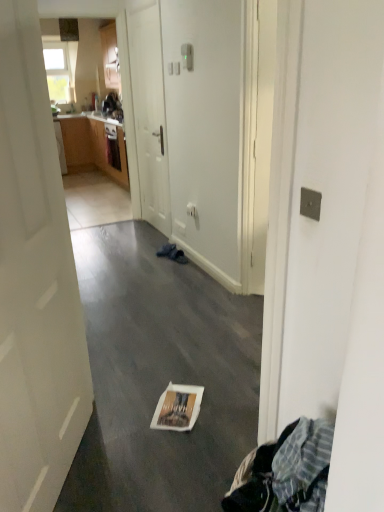
Question: From the image's perspective, does white paper bag at center appear lower than white glossy door at left, arranged as the 1th door when viewed from the front?

Choices:
 (A) yes
 (B) no

Answer: (A)

Question: Does white paper bag at center turn towards white glossy door at left, the 2th door viewed from the back?

Choices:
 (A) no
 (B) yes

Answer: (A)

Question: Is white glossy door at left, arranged as the 1th door when viewed from the front, surrounded by white paper bag at center?

Choices:
 (A) no
 (B) yes

Answer: (A)

Question: From a real-world perspective, is white paper bag at center positioned over white glossy door at left, the 2th door viewed from the back, based on gravity?

Choices:
 (A) no
 (B) yes

Answer: (A)

Question: Is white paper bag at center completely or partially outside of white glossy door at left, the 2th door viewed from the back?

Choices:
 (A) no
 (B) yes

Answer: (B)

Question: Based on their positions, is white glossy magazine at center located to the left or right of white paper bag at center?

Choices:
 (A) right
 (B) left

Answer: (A)

Question: From a real-world perspective, is white glossy magazine at center above or below white paper bag at center?

Choices:
 (A) above
 (B) below

Answer: (B)

Question: Considering the positions of point (188, 396) and point (140, 301), is point (188, 396) closer or farther from the camera than point (140, 301)?

Choices:
 (A) farther
 (B) closer

Answer: (B)

Question: Relative to white paper bag at center, is white glossy magazine at center in front or behind?

Choices:
 (A) behind
 (B) front

Answer: (A)

Question: Relative to white paper bag at center, is white glossy door at left, the 2th door viewed from the back, in front or behind?

Choices:
 (A) front
 (B) behind

Answer: (A)

Question: Choose the correct answer: Is white glossy door at left, the 2th door viewed from the back, inside white paper bag at center or outside it?

Choices:
 (A) outside
 (B) inside

Answer: (A)

Question: From the image's perspective, is white glossy door at left, arranged as the 1th door when viewed from the front, above or below white paper bag at center?

Choices:
 (A) below
 (B) above

Answer: (B)

Question: From their relative heights in the image, would you say white glossy door at left, the 2th door viewed from the back, is taller or shorter than white paper bag at center?

Choices:
 (A) tall
 (B) short

Answer: (A)

Question: Considering the positions of white matte door at center, the first door viewed from the back, and white paper bag at center in the image, is white matte door at center, the first door viewed from the back, wider or thinner than white paper bag at center?

Choices:
 (A) thin
 (B) wide

Answer: (A)

Question: From a real-world perspective, relative to white paper bag at center, is white matte door at center, which is the second door from front to back, vertically above or below?

Choices:
 (A) above
 (B) below

Answer: (A)